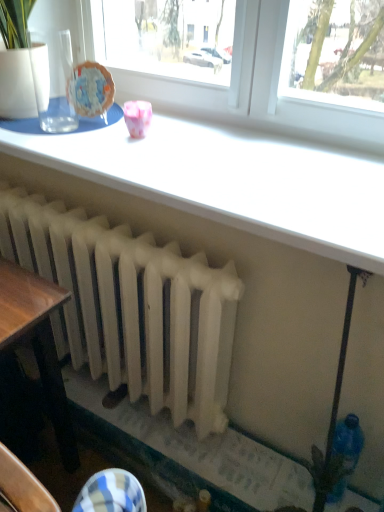
Image resolution: width=384 pixels, height=512 pixels. Find the location of `vacant area situated to the left side of pink glossy cup at upper center`. vacant area situated to the left side of pink glossy cup at upper center is located at coordinates (61, 144).